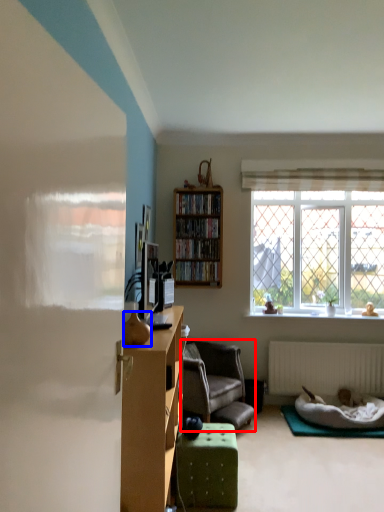
Question: Among these objects, which one is nearest to the camera, chair (highlighted by a red box) or vase (highlighted by a blue box)?

Choices:
 (A) chair
 (B) vase

Answer: (B)